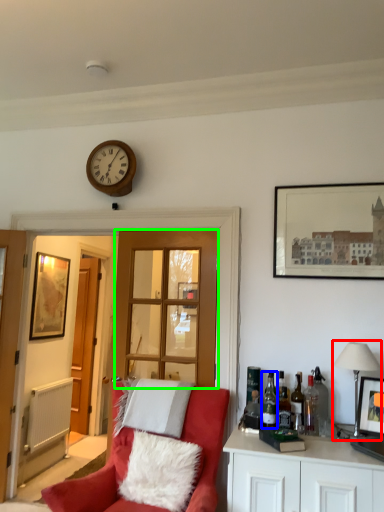
Question: Which is farther away from lamp (highlighted by a red box)? bottle (highlighted by a blue box) or glass door (highlighted by a green box)?

Choices:
 (A) bottle
 (B) glass door

Answer: (B)